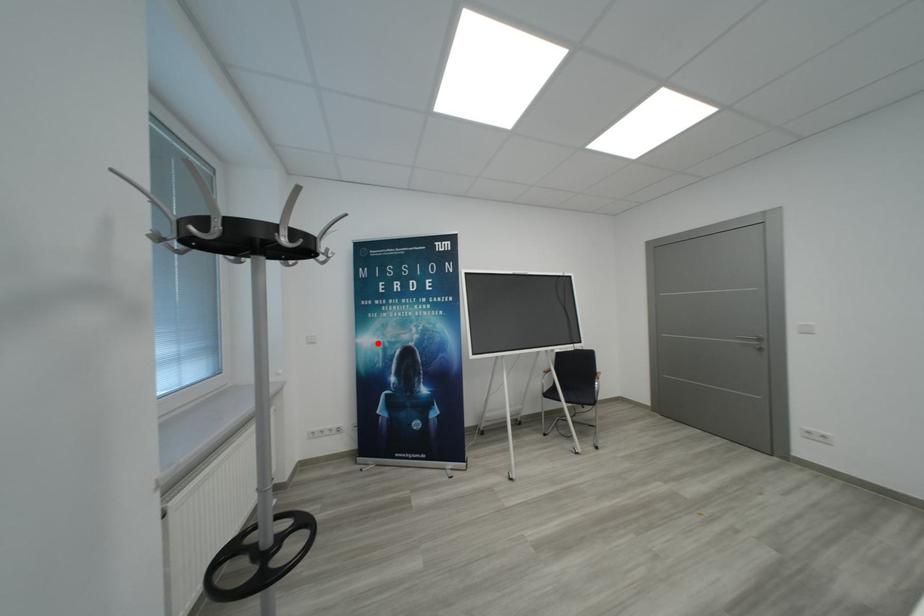
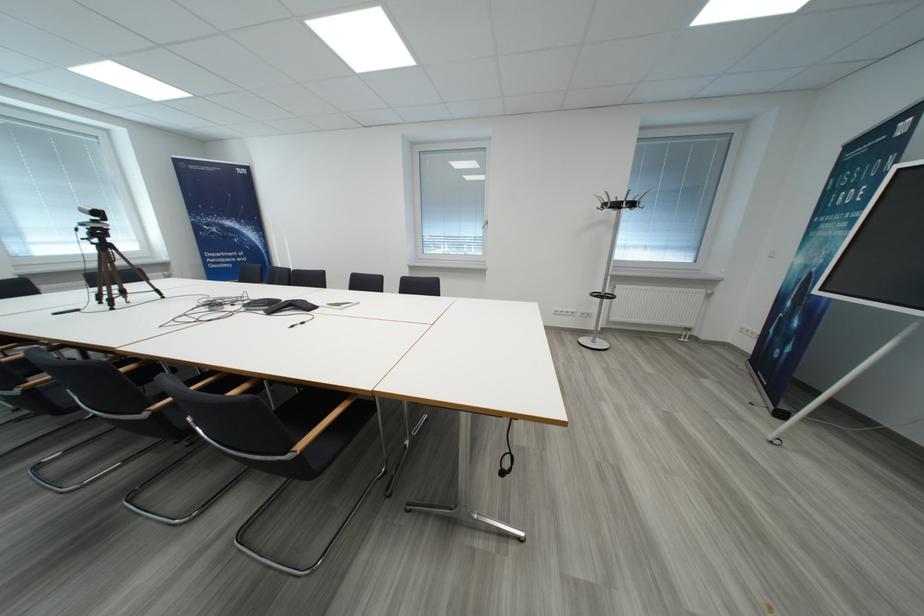
In the second image, find the point that corresponds to the highlighted location in the first image.

(807, 264)